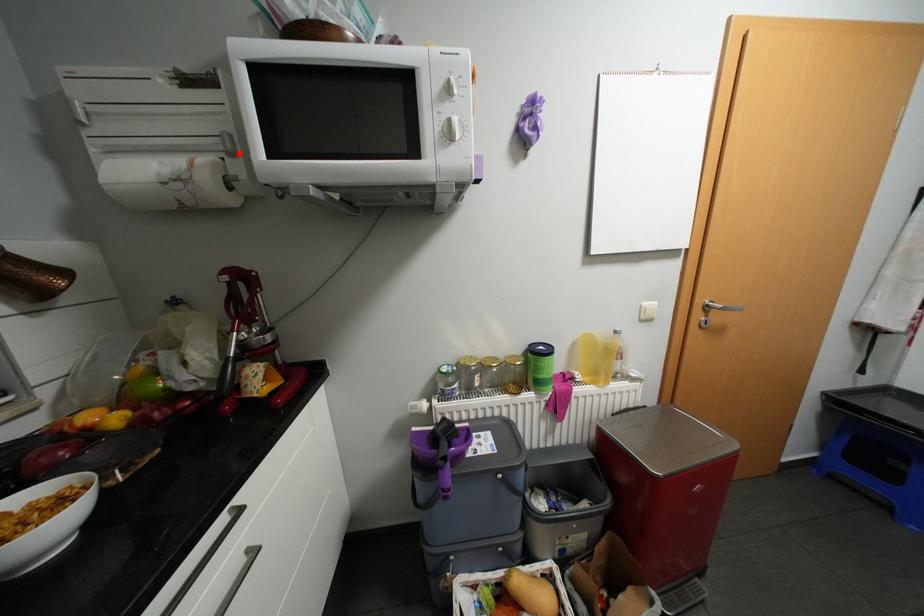
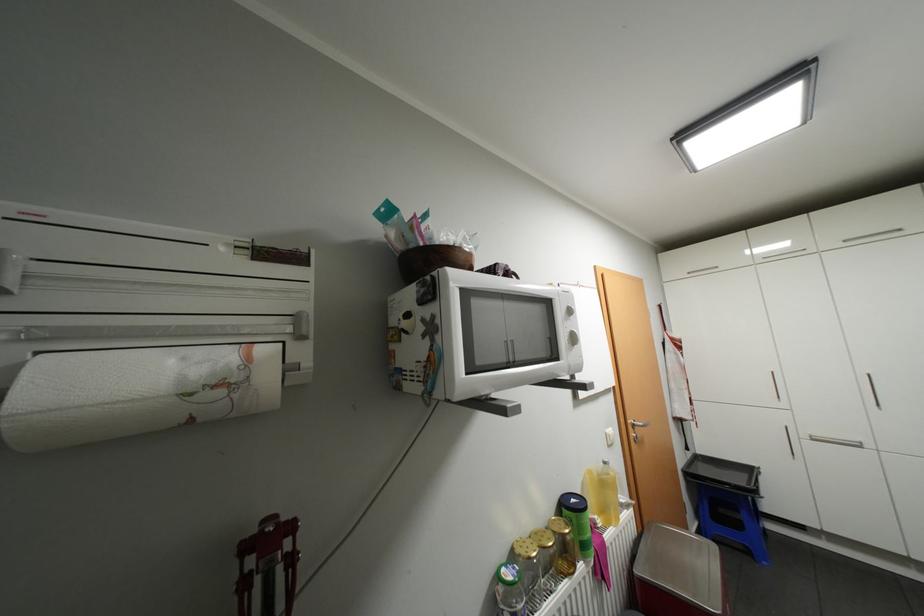
In the second image, find the point that corresponds to the highlighted location in the first image.

(309, 336)